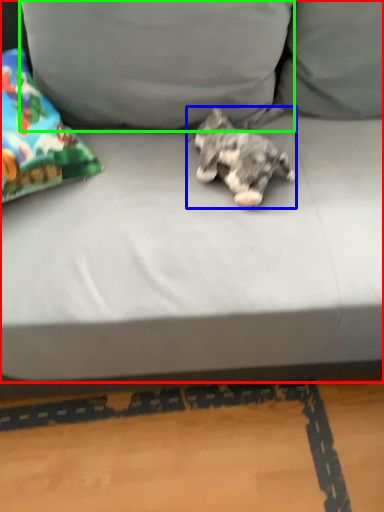
Question: Which object is positioned closest to studio couch (highlighted by a red box)? Select from dog (highlighted by a blue box) and pillow (highlighted by a green box).

Choices:
 (A) dog
 (B) pillow

Answer: (B)